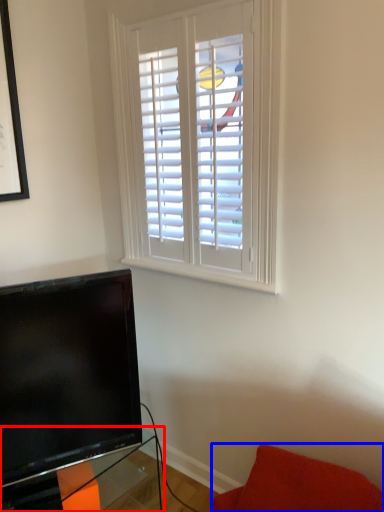
Question: Which point is closer to the camera, table (highlighted by a red box) or furniture (highlighted by a blue box)?

Choices:
 (A) table
 (B) furniture

Answer: (B)